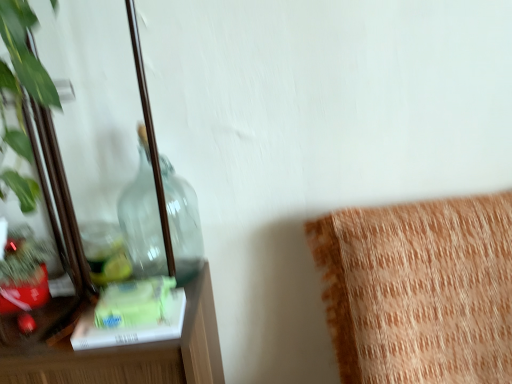
Question: Is transparent glass bottle at left behind clear glass mirror at left?

Choices:
 (A) yes
 (B) no

Answer: (A)

Question: Are transparent glass bottle at left and clear glass mirror at left far apart?

Choices:
 (A) yes
 (B) no

Answer: (B)

Question: From the image's perspective, is transparent glass bottle at left under clear glass mirror at left?

Choices:
 (A) no
 (B) yes

Answer: (B)

Question: Are transparent glass bottle at left and clear glass mirror at left beside each other?

Choices:
 (A) no
 (B) yes

Answer: (A)

Question: Does transparent glass bottle at left appear on the left side of clear glass mirror at left?

Choices:
 (A) no
 (B) yes

Answer: (A)

Question: From a real-world perspective, is orange textured cushion at upper right positioned above or below clear glass mirror at left?

Choices:
 (A) below
 (B) above

Answer: (A)

Question: Based on their sizes in the image, would you say orange textured cushion at upper right is bigger or smaller than clear glass mirror at left?

Choices:
 (A) small
 (B) big

Answer: (B)

Question: Does point (371, 274) appear closer or farther from the camera than point (68, 211)?

Choices:
 (A) farther
 (B) closer

Answer: (A)

Question: Considering the positions of orange textured cushion at upper right and clear glass mirror at left in the image, is orange textured cushion at upper right taller or shorter than clear glass mirror at left?

Choices:
 (A) short
 (B) tall

Answer: (B)

Question: Relative to orange textured cushion at upper right, is transparent glass bottle at left in front or behind?

Choices:
 (A) behind
 (B) front

Answer: (A)

Question: From a real-world perspective, is transparent glass bottle at left above or below orange textured cushion at upper right?

Choices:
 (A) above
 (B) below

Answer: (A)

Question: Looking at the image, does transparent glass bottle at left seem bigger or smaller compared to orange textured cushion at upper right?

Choices:
 (A) big
 (B) small

Answer: (B)

Question: Is point (142, 163) positioned closer to the camera than point (329, 231)?

Choices:
 (A) farther
 (B) closer

Answer: (A)

Question: Is orange textured cushion at upper right taller or shorter than transparent glass bottle at left?

Choices:
 (A) short
 (B) tall

Answer: (B)

Question: From a real-world perspective, relative to transparent glass bottle at left, is orange textured cushion at upper right vertically above or below?

Choices:
 (A) above
 (B) below

Answer: (B)